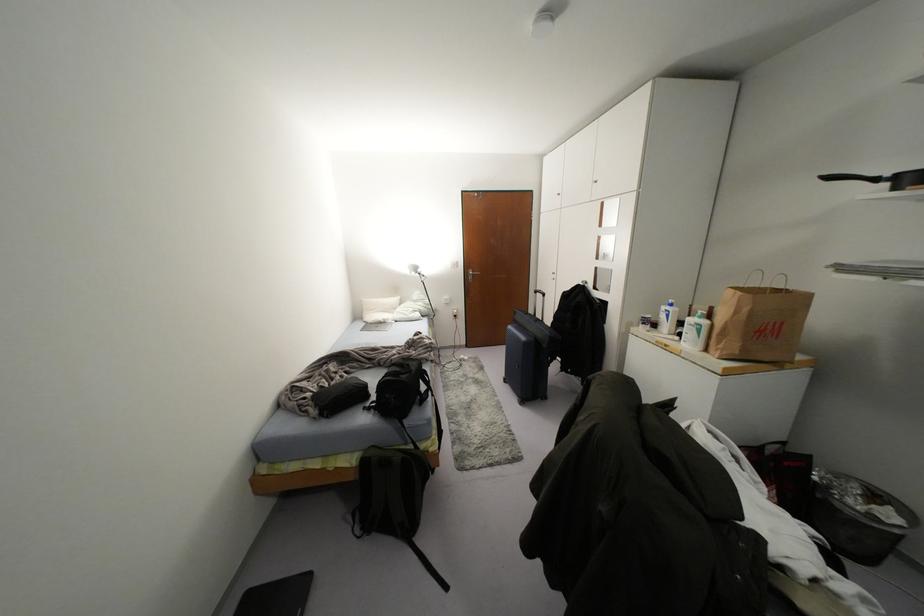
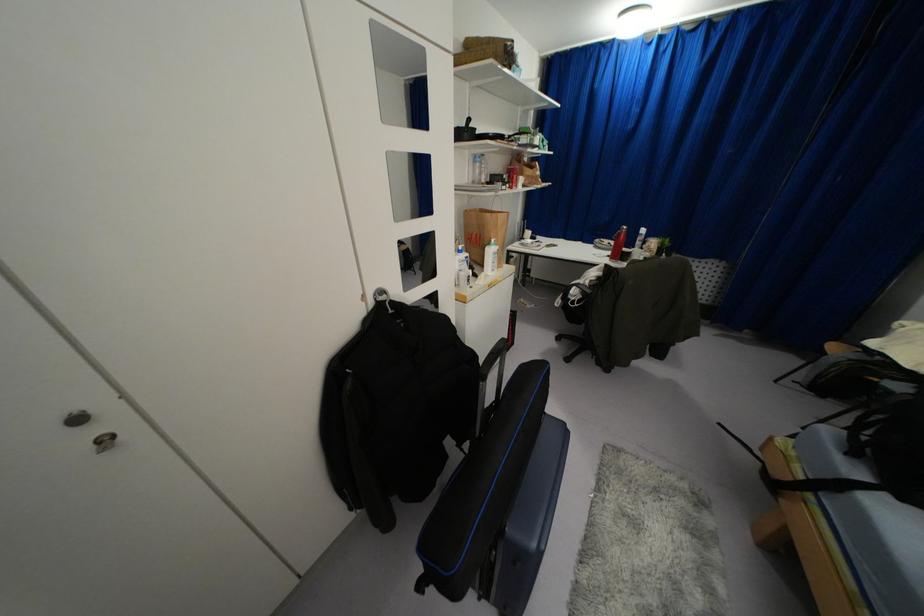
In the second image, find the point that corresponds to (x=703, y=322) in the first image.

(495, 246)